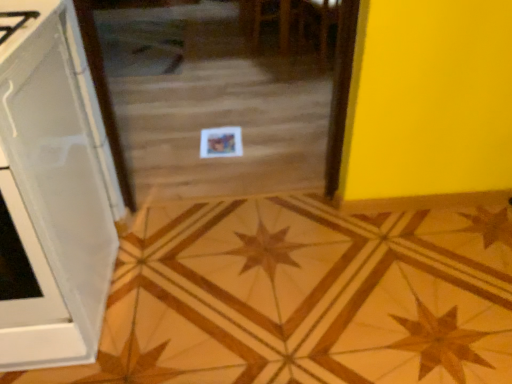
Question: From a real-world perspective, is white glossy cabinet at left on transparent glass door at center?

Choices:
 (A) no
 (B) yes

Answer: (B)

Question: From the image's perspective, is white glossy cabinet at left under transparent glass door at center?

Choices:
 (A) yes
 (B) no

Answer: (A)

Question: Does white glossy cabinet at left have a greater height compared to transparent glass door at center?

Choices:
 (A) yes
 (B) no

Answer: (A)

Question: Can you confirm if white glossy cabinet at left is bigger than transparent glass door at center?

Choices:
 (A) no
 (B) yes

Answer: (A)

Question: From the image's perspective, is white glossy cabinet at left located above transparent glass door at center?

Choices:
 (A) no
 (B) yes

Answer: (A)

Question: Are white glossy cabinet at left and transparent glass door at center far apart?

Choices:
 (A) no
 (B) yes

Answer: (B)

Question: Is wooden star at center positioned beyond the bounds of transparent glass door at center?

Choices:
 (A) no
 (B) yes

Answer: (B)

Question: Would you consider wooden star at center to be distant from transparent glass door at center?

Choices:
 (A) no
 (B) yes

Answer: (B)

Question: Can you confirm if wooden star at center is smaller than transparent glass door at center?

Choices:
 (A) yes
 (B) no

Answer: (A)

Question: Is transparent glass door at center at the back of wooden star at center?

Choices:
 (A) no
 (B) yes

Answer: (B)

Question: Is wooden star at center aimed at transparent glass door at center?

Choices:
 (A) yes
 (B) no

Answer: (B)

Question: Does wooden star at center have a lesser width compared to transparent glass door at center?

Choices:
 (A) yes
 (B) no

Answer: (A)

Question: Would you say white glossy cabinet at left is part of transparent glass door at center's contents?

Choices:
 (A) no
 (B) yes

Answer: (A)